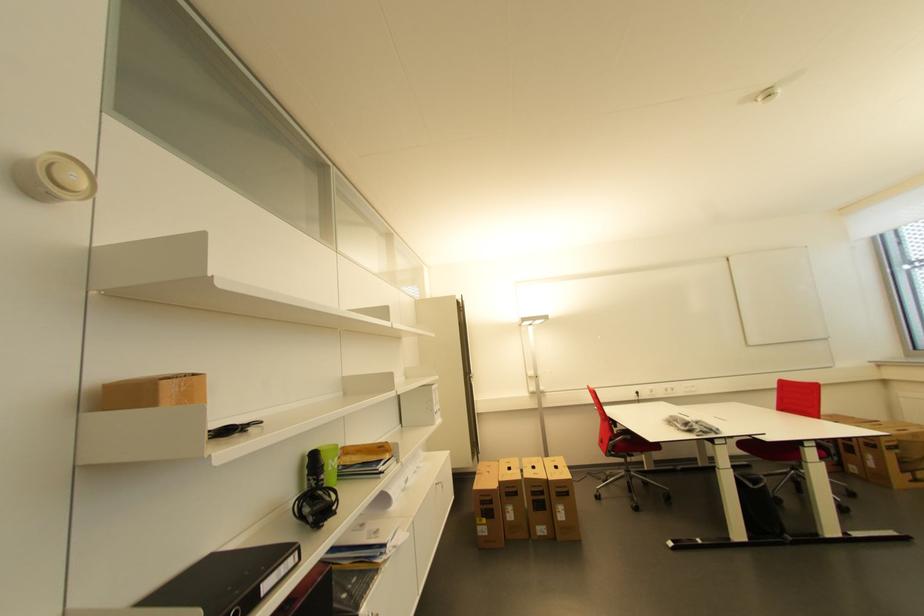
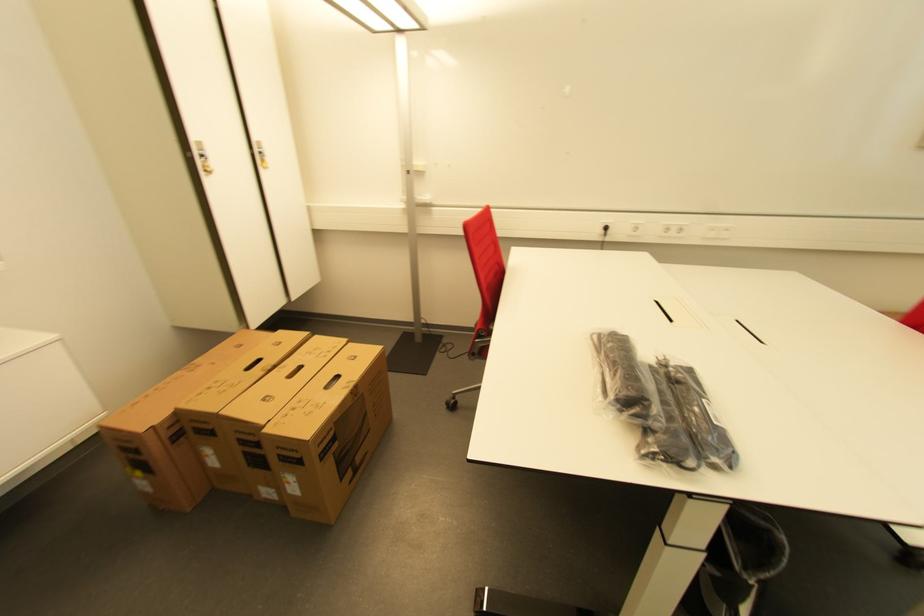
Where in the second image is the point corresponding to (675,392) from the first image?

(676, 233)